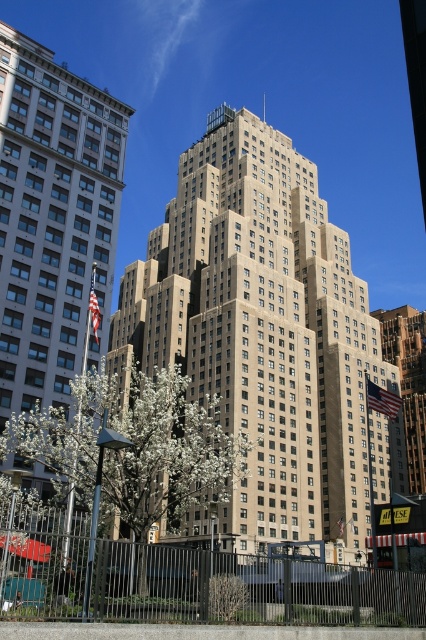
How much distance is there between white blossoming tree at lower left and gold textured building at center?

A distance of 60.34 meters exists between white blossoming tree at lower left and gold textured building at center.

Who is positioned more to the left, white blossoming tree at lower left or gold textured building at center?

Positioned to the left is white blossoming tree at lower left.

The image size is (426, 640). In order to click on white blossoming tree at lower left in this screenshot , I will do `click(132, 448)`.

Identify the location of white blossoming tree at lower left. This screenshot has height=640, width=426. (132, 448).

Who is positioned more to the right, beige stone building at center or white blossoming tree at lower left?

beige stone building at center

Between beige stone building at center and white blossoming tree at lower left, which one has more height?

beige stone building at center is taller.

Image resolution: width=426 pixels, height=640 pixels. Describe the element at coordinates (264, 333) in the screenshot. I see `beige stone building at center` at that location.

Where is `beige stone building at center`? The height and width of the screenshot is (640, 426). beige stone building at center is located at coordinates (264, 333).

Describe the element at coordinates (264, 333) in the screenshot. I see `beige stone building at center` at that location.

Describe the element at coordinates (264, 333) in the screenshot. The image size is (426, 640). I see `beige stone building at center` at that location.

This screenshot has height=640, width=426. Identify the location of beige stone building at center. pos(264,333).